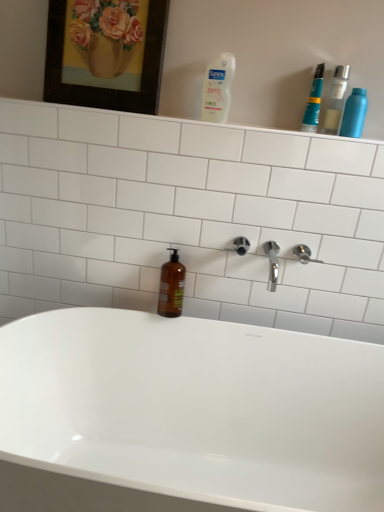
Where is `free point above white glossy shelf at upper center (from a real-world perspective)`? This screenshot has height=512, width=384. free point above white glossy shelf at upper center (from a real-world perspective) is located at coordinates (195, 113).